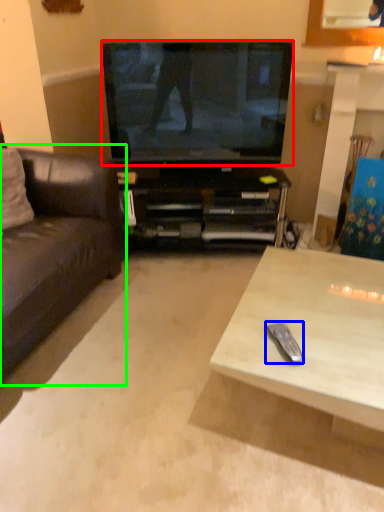
Question: Which object is the farthest from television (highlighted by a red box)? Choose among these: remote control (highlighted by a blue box) or studio couch (highlighted by a green box).

Choices:
 (A) remote control
 (B) studio couch

Answer: (A)